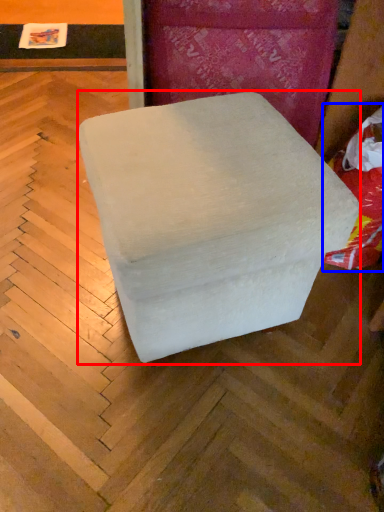
Question: Which object appears closest to the camera in this image, furniture (highlighted by a red box) or bean bag chair (highlighted by a blue box)?

Choices:
 (A) furniture
 (B) bean bag chair

Answer: (A)